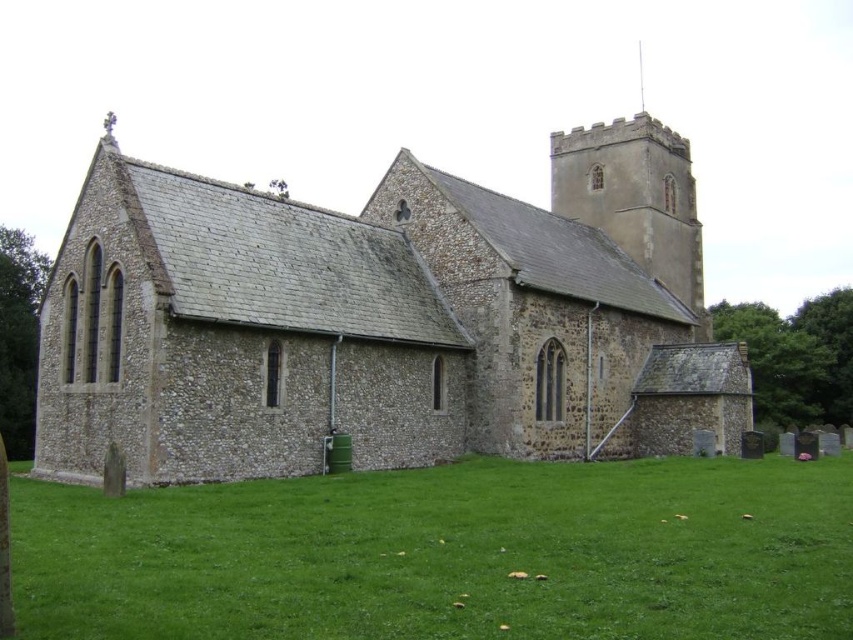
Based on the scene described, which object occupies more horizontal space in the image? The stone church at center or the green grass at lower center?

The stone church at center might be wider than green grass at lower center according to the description.

You are standing at the entrance of the stone church at center. If you walk straight ahead, will you exit the church building or enter another part of it?

The stone church at center is positioned at point (383,320), so walking straight ahead from the entrance would lead you into the main body of the church, not exiting it. The building has a rectangular main body with a slightly slanted roofline extending towards the front, suggesting the entrance faces the front side. Since the entrance is at the front, moving forward would take you deeper into the main structure rather than exiting. Additionally, there is a smaller section attached to the right, but this